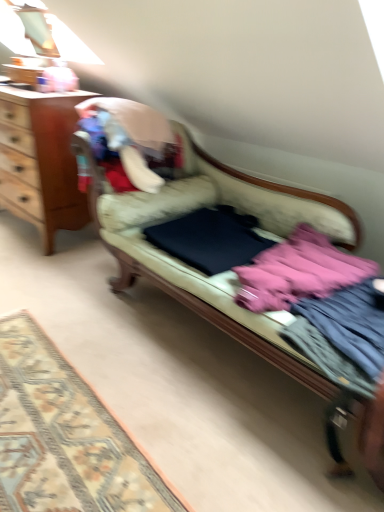
Locate an element on the screen. The image size is (384, 512). vacant point to the right of carpeted rug at lower left is located at coordinates (204, 406).